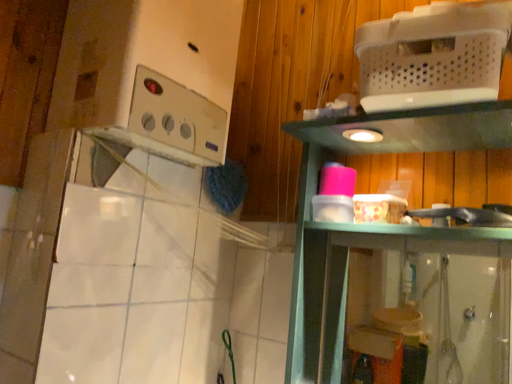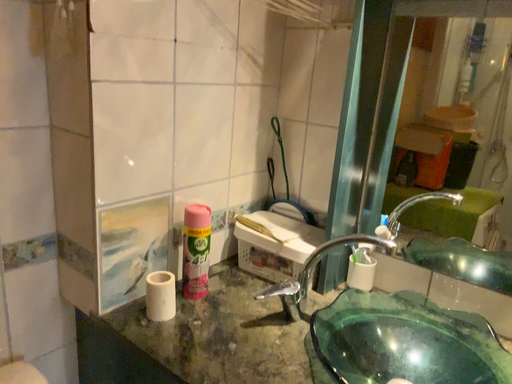
Question: How did the camera likely rotate when shooting the video?

Choices:
 (A) rotated upward
 (B) rotated downward

Answer: (B)